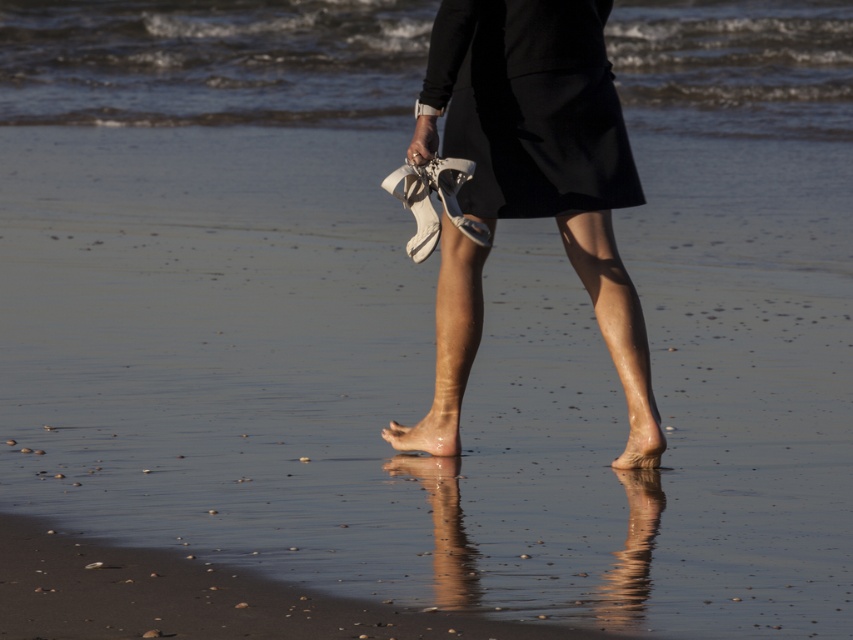
Which of these two, white leather sandals at center or dry skin foot at lower center, stands shorter?

Standing shorter between the two is dry skin foot at lower center.

Does point (473, 141) come farther from viewer compared to point (636, 433)?

That is True.

At what (x,y) coordinates should I click in order to perform the action: click on white leather sandals at center. Please return your answer as a coordinate pair (x, y). Looking at the image, I should click on click(x=544, y=144).

Based on the photo, is clear water at center above dry skin foot at lower center?

Correct, clear water at center is located above dry skin foot at lower center.

Between point (357, 29) and point (653, 419), which one is positioned behind?

Point (357, 29)

You are a GUI agent. You are given a task and a screenshot of the screen. Output one action in this format:
    pyautogui.click(x=<x>, y=<y>)
    Task: Click on the clear water at center
    This screenshot has width=853, height=640.
    Given the screenshot: What is the action you would take?
    pyautogui.click(x=212, y=61)

Is clear water at center above smooth skin foot at center?

Yes.

Does clear water at center have a lesser width compared to smooth skin foot at center?

No.

Which is behind, point (409, 45) or point (427, 451)?

The point (409, 45) is behind.

Identify the location of clear water at center. (212, 61).